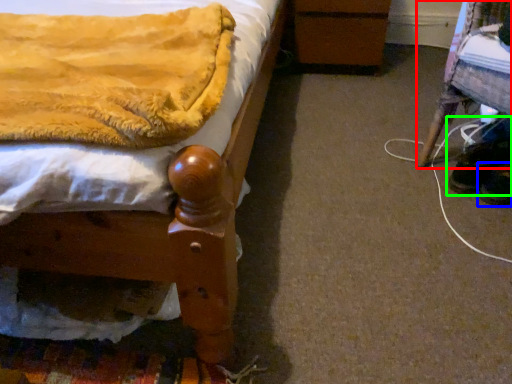
Question: Estimate the real-world distances between objects in this image. Which object is closer to furniture (highlighted by a red box), footwear (highlighted by a blue box) or footwear (highlighted by a green box)?

Choices:
 (A) footwear
 (B) footwear

Answer: (B)